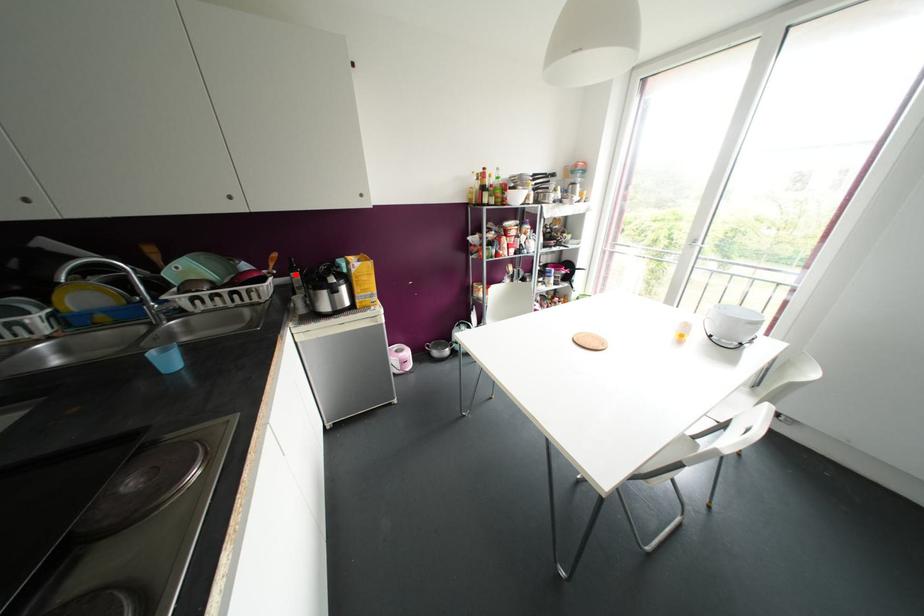
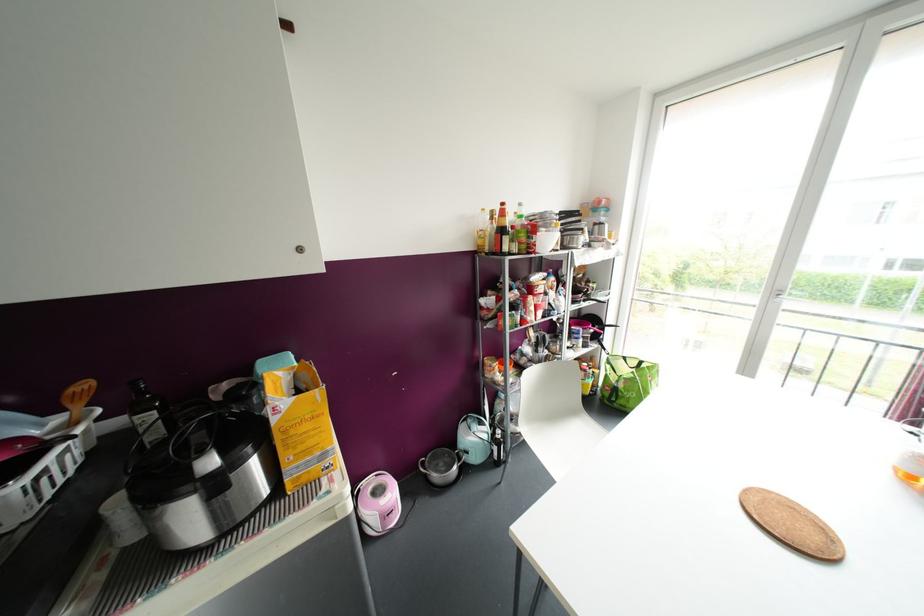
Question: I am providing you with two images of the same scene from different viewpoints. A red point is marked on the first image. At the location where the point appears in image 1, is it still visible in image 2?

Choices:
 (A) Yes
 (B) No

Answer: (A)